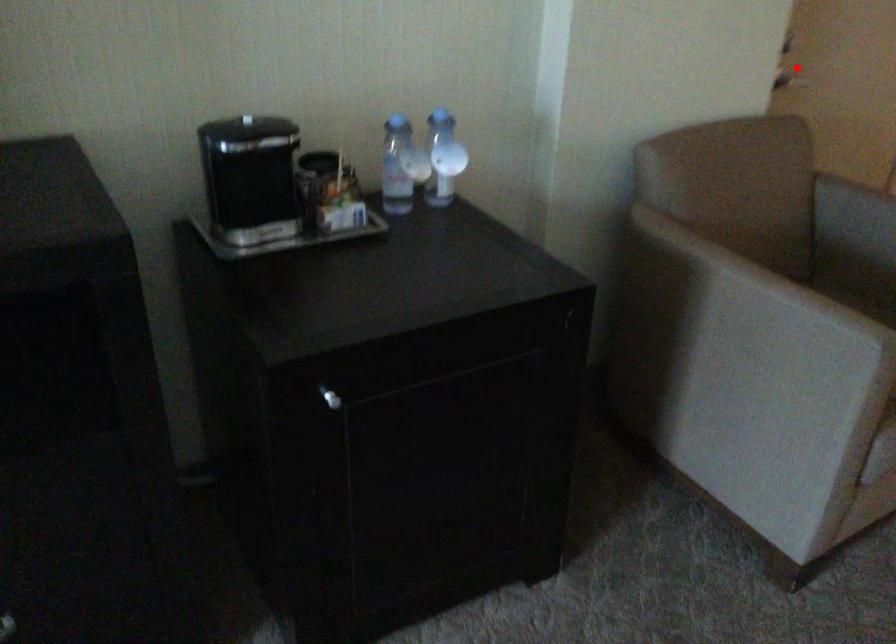
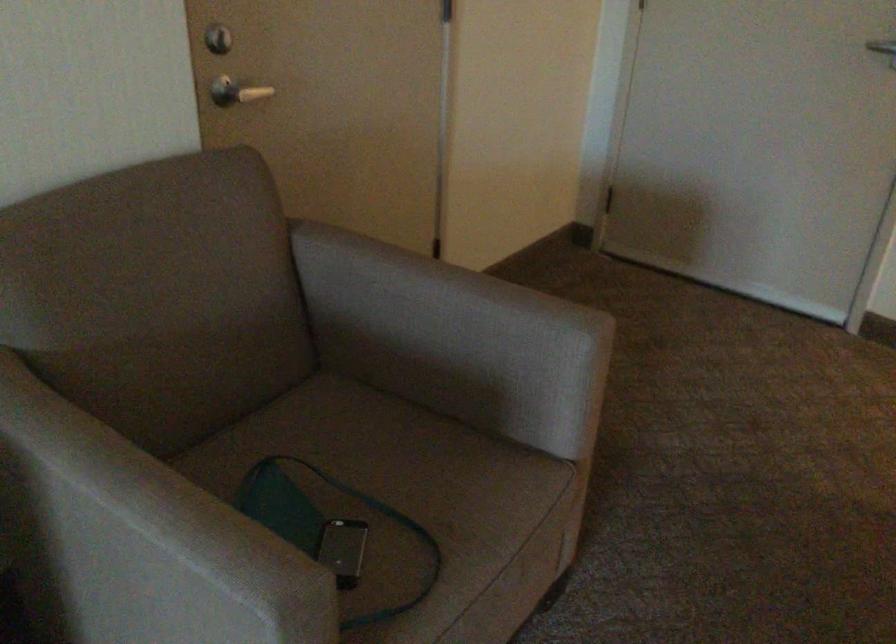
Question: I am providing you with two images of the same scene from different viewpoints. A red point is shown in image1. For the corresponding object point in image2, is it positioned nearer or farther from the camera?

Choices:
 (A) Nearer
 (B) Farther

Answer: (A)